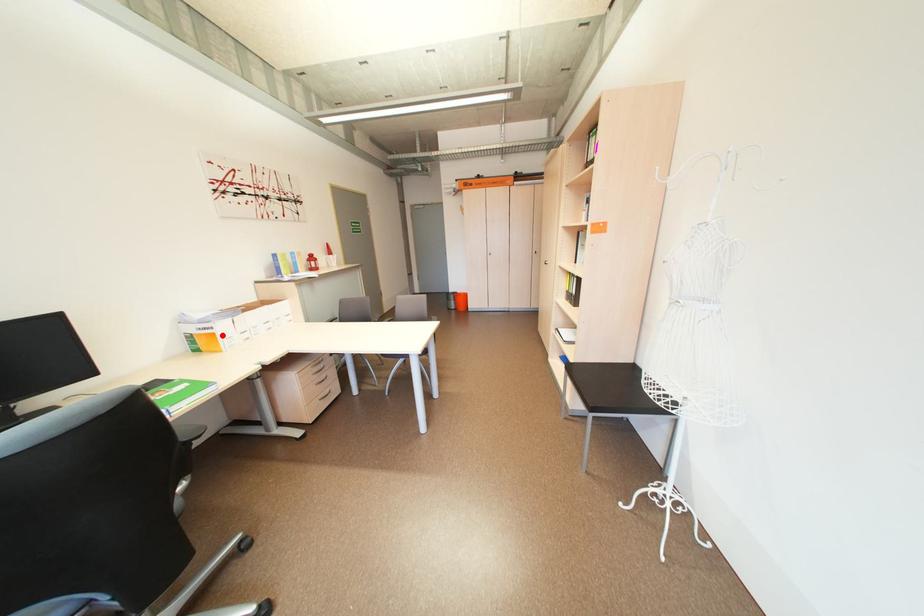
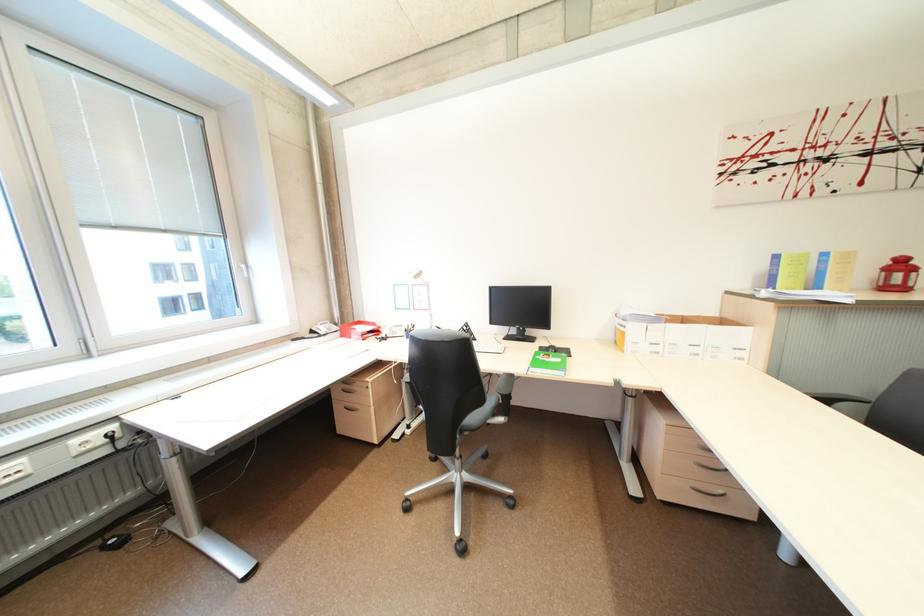
The point at the highlighted location is marked in the first image. Where is the corresponding point in the second image?

(633, 334)